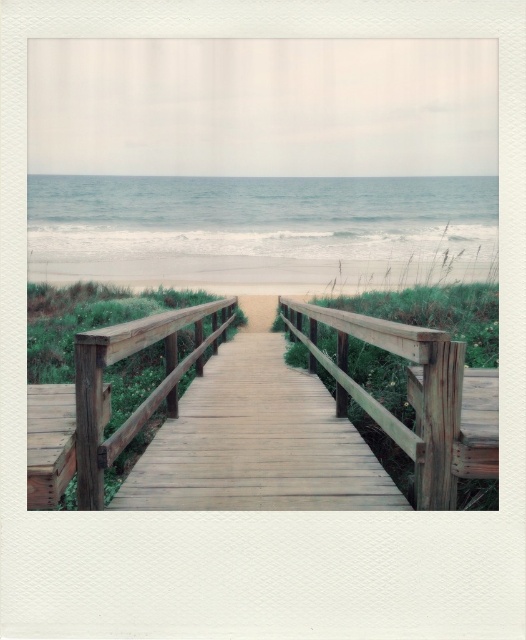
Question: Which object is positioned farthest from the wooden rail at center?

Choices:
 (A) wooden bridge at center
 (B) beige sandy beach at center

Answer: (B)

Question: Which point appears farthest from the camera in this image?

Choices:
 (A) click(259, 328)
 (B) click(294, 378)

Answer: (A)

Question: Which of the following is the farthest from the observer?

Choices:
 (A) (180, 416)
 (B) (93, 458)

Answer: (A)

Question: Can you confirm if wooden bridge at center is bigger than wooden rail at center?

Choices:
 (A) no
 (B) yes

Answer: (A)

Question: Does wooden rail at center have a smaller size compared to beige sandy beach at center?

Choices:
 (A) no
 (B) yes

Answer: (A)

Question: Is wooden bridge at center wider than wooden rail at center?

Choices:
 (A) yes
 (B) no

Answer: (B)